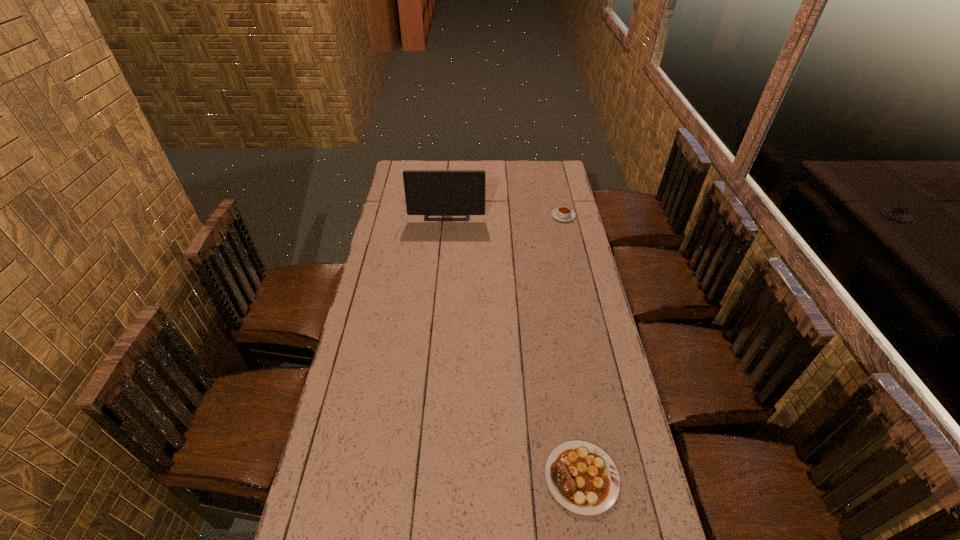
Where is `the tallest object`? The width and height of the screenshot is (960, 540). the tallest object is located at coordinates (427, 192).

What are the coordinates of `computer monitor` in the screenshot? It's located at (427, 192).

Locate an element on the screen. The height and width of the screenshot is (540, 960). pudding is located at coordinates (562, 213).

At what (x,y) coordinates should I click in order to perform the action: click on steak. Please return your answer as a coordinate pair (x, y). Looking at the image, I should click on (582, 477).

I want to click on vacant area situated 0.390m on the screen side of the computer monitor, so click(442, 280).

Find the location of `free space located on the left of the pudding`. free space located on the left of the pudding is located at coordinates tap(535, 216).

Where is `vacant space located 0.260m on the left of the steak`? Image resolution: width=960 pixels, height=540 pixels. vacant space located 0.260m on the left of the steak is located at coordinates (451, 477).

The width and height of the screenshot is (960, 540). I want to click on object located in the left edge section of the desktop, so tap(427, 192).

Where is `pudding present at the right edge`? pudding present at the right edge is located at coordinates (562, 213).

Locate an element on the screen. steak that is at the right edge is located at coordinates (582, 477).